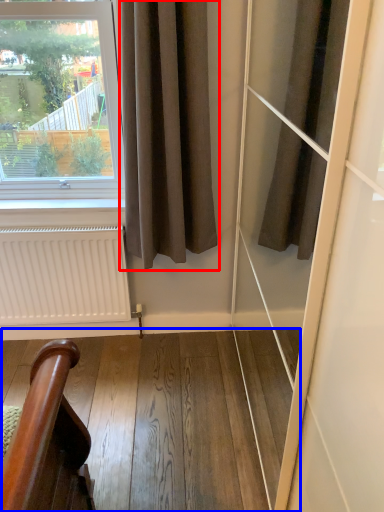
Question: Which object is closer to the camera taking this photo, curtain (highlighted by a red box) or stairwell (highlighted by a blue box)?

Choices:
 (A) curtain
 (B) stairwell

Answer: (A)